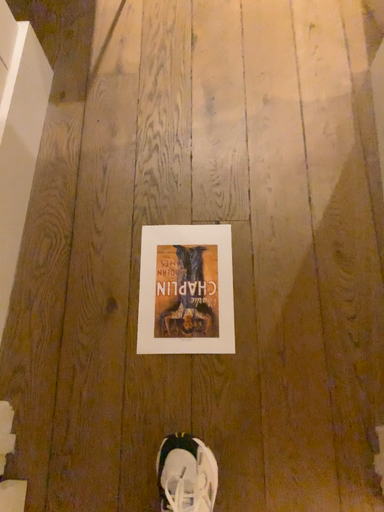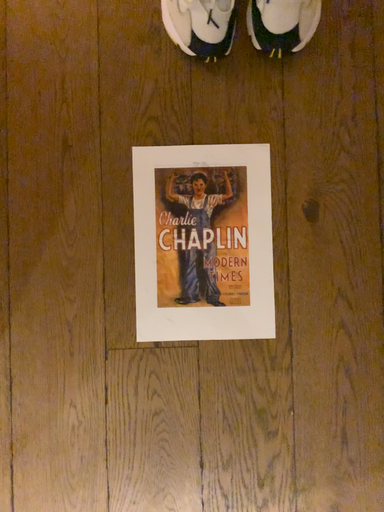
Question: Which way did the camera rotate in the video?

Choices:
 (A) rotated upward
 (B) rotated downward

Answer: (A)